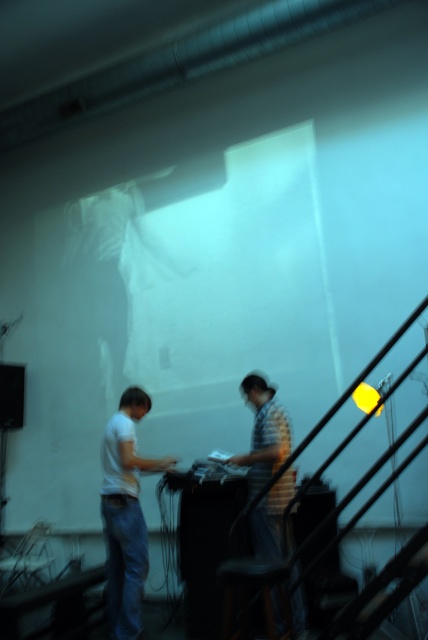
Question: Can you confirm if white matte shirt at left is positioned above dark brown wooden stool at lower center?

Choices:
 (A) no
 (B) yes

Answer: (B)

Question: Where is striped cotton shirt at center located in relation to dark brown wooden stool at lower center in the image?

Choices:
 (A) right
 (B) left

Answer: (A)

Question: Which object is the closest to the white matte shirt at left?

Choices:
 (A) striped cotton shirt at center
 (B) dark brown wooden stool at lower center

Answer: (A)

Question: Considering the relative positions of white matte shirt at left and striped cotton shirt at center in the image provided, where is white matte shirt at left located with respect to striped cotton shirt at center?

Choices:
 (A) left
 (B) right

Answer: (A)

Question: Which object is farther from the camera taking this photo?

Choices:
 (A) dark brown wooden stool at lower center
 (B) striped cotton shirt at center

Answer: (B)

Question: Based on their relative distances, which object is farther from the white matte shirt at left?

Choices:
 (A) striped cotton shirt at center
 (B) dark brown wooden stool at lower center

Answer: (B)